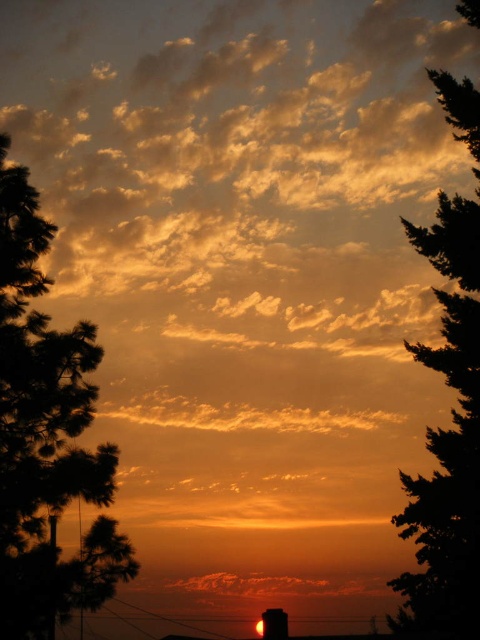
Question: Is green leafy tree at left below green leafy tree at right?

Choices:
 (A) no
 (B) yes

Answer: (A)

Question: Does green leafy tree at left appear on the right side of green leafy tree at right?

Choices:
 (A) no
 (B) yes

Answer: (A)

Question: Which object appears closest to the camera in this image?

Choices:
 (A) green leafy tree at left
 (B) green leafy tree at right

Answer: (A)

Question: Is green leafy tree at left closer to camera compared to green leafy tree at right?

Choices:
 (A) yes
 (B) no

Answer: (A)

Question: Which object is closer to the camera taking this photo?

Choices:
 (A) green leafy tree at left
 (B) green leafy tree at right

Answer: (A)